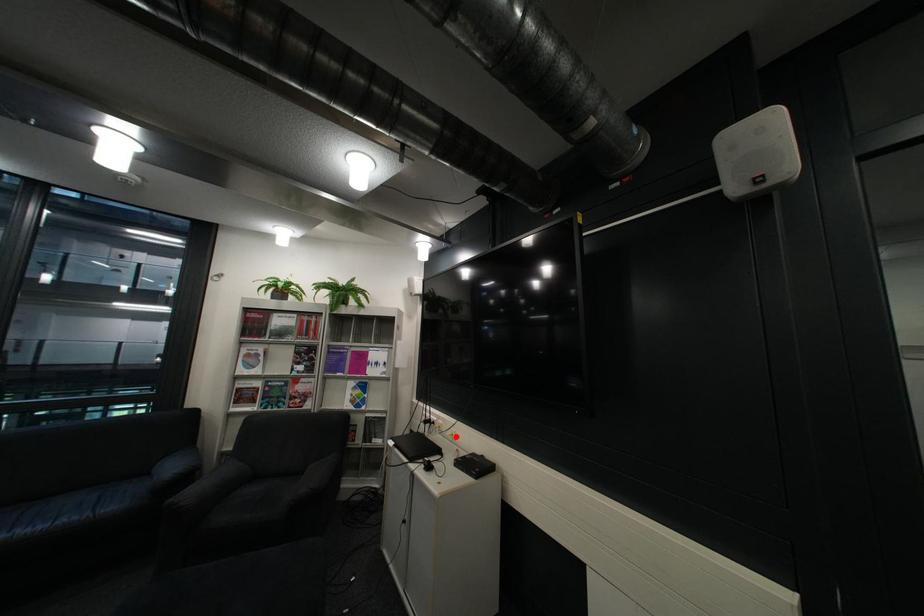
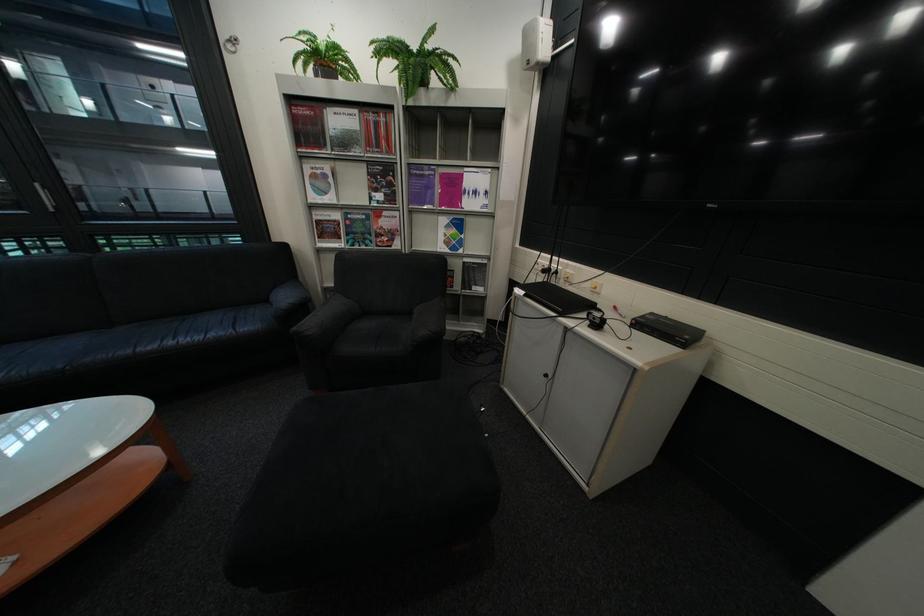
The point at the highlighted location is marked in the first image. Where is the corresponding point in the second image?

(589, 288)